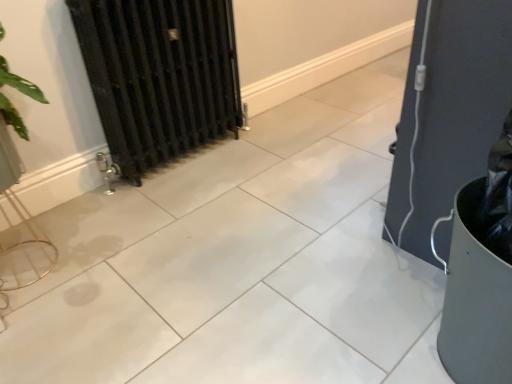
Question: In the image, is matte black guitar case at right positioned in front of or behind black metal radiator at left?

Choices:
 (A) behind
 (B) front

Answer: (B)

Question: Is matte black guitar case at right wider or thinner than black metal radiator at left?

Choices:
 (A) thin
 (B) wide

Answer: (B)

Question: Based on their sizes in the image, would you say matte black guitar case at right is bigger or smaller than black metal radiator at left?

Choices:
 (A) small
 (B) big

Answer: (A)

Question: From a real-world perspective, is black metal radiator at left positioned above or below matte black guitar case at right?

Choices:
 (A) above
 (B) below

Answer: (A)

Question: Is point (222, 3) positioned closer to the camera than point (409, 155)?

Choices:
 (A) closer
 (B) farther

Answer: (B)

Question: In the image, is black metal radiator at left positioned in front of or behind matte black guitar case at right?

Choices:
 (A) behind
 (B) front

Answer: (A)

Question: Is black metal radiator at left wider or thinner than matte black guitar case at right?

Choices:
 (A) thin
 (B) wide

Answer: (A)